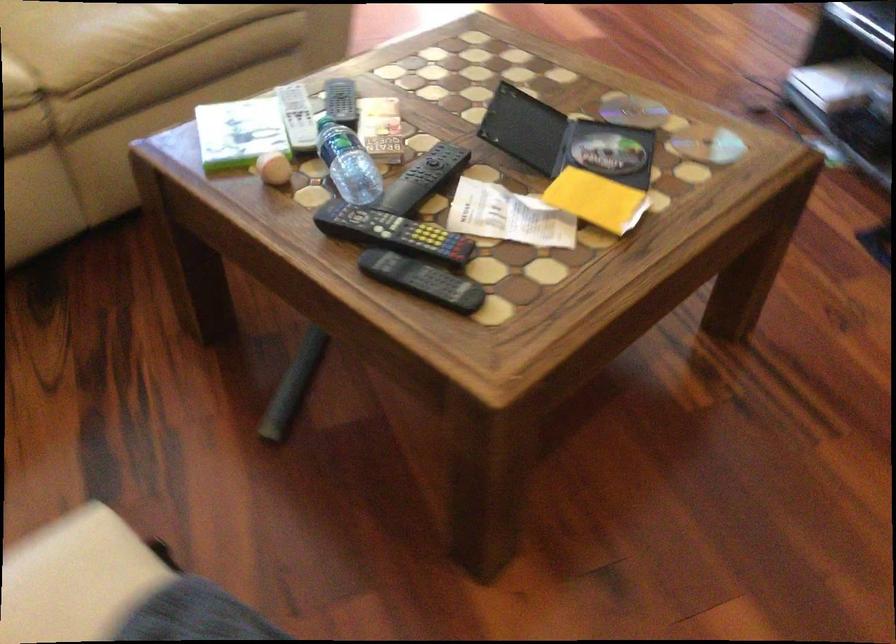
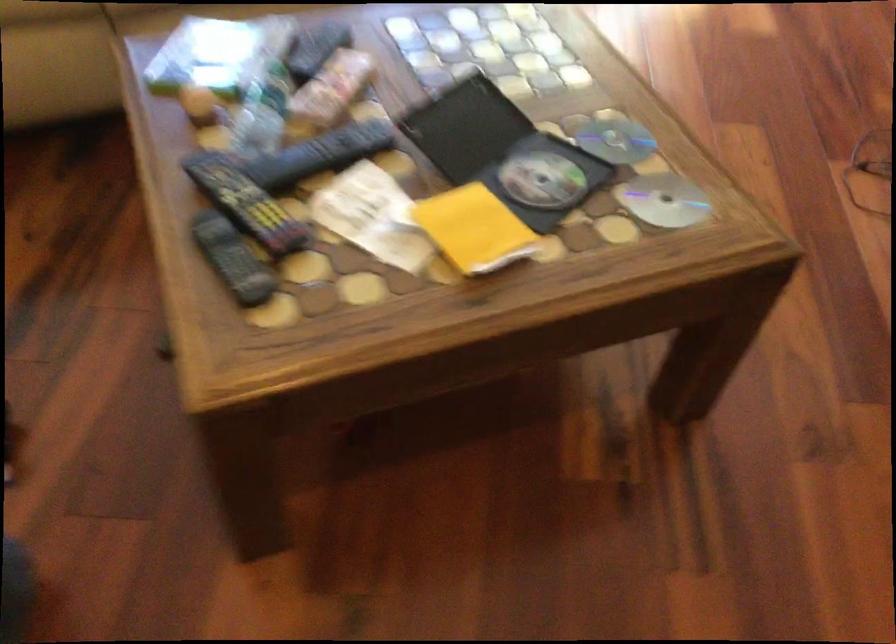
Where in the second image is the point corresponding to (606,152) from the first image?

(541, 180)